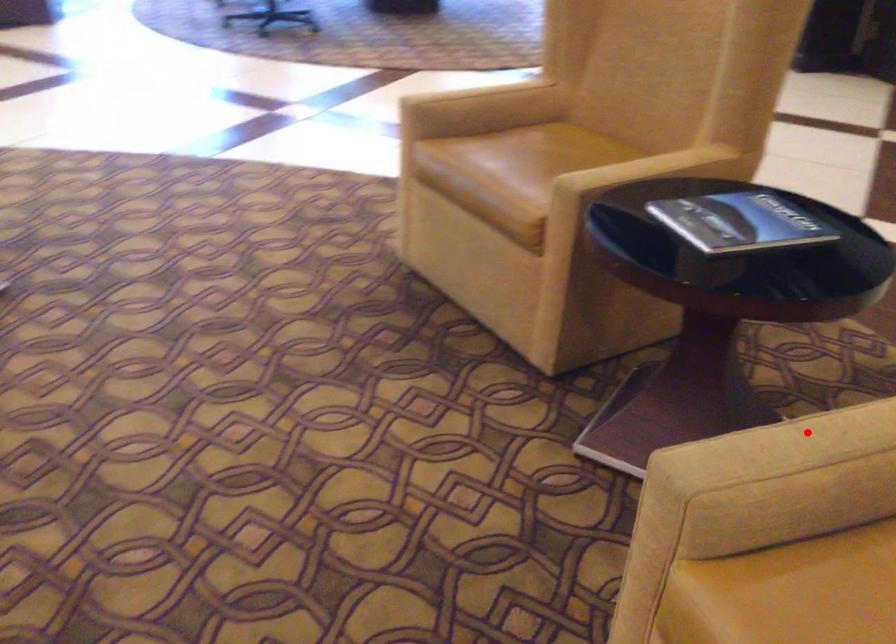
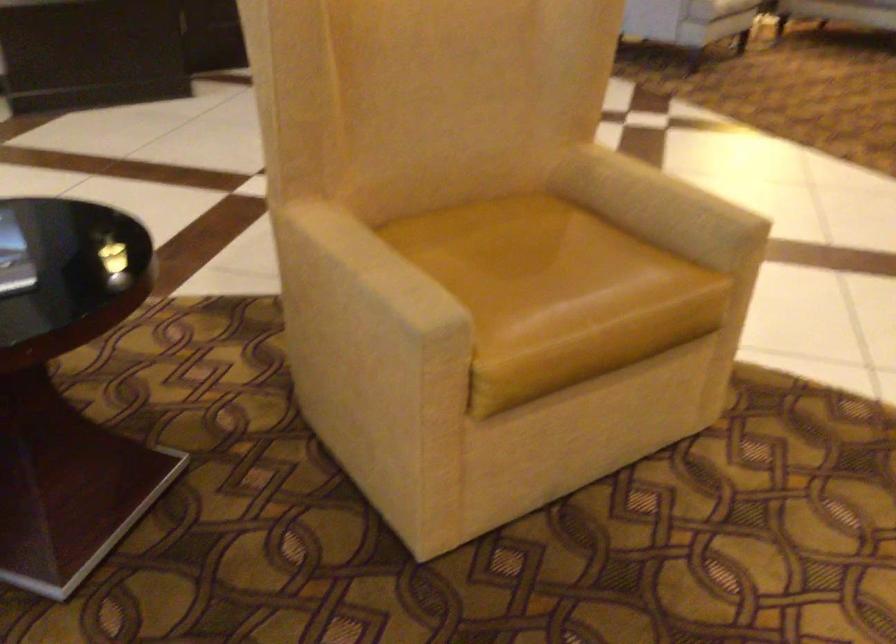
Locate, in the second image, the point that corresponds to the highlighted location in the first image.

(375, 266)